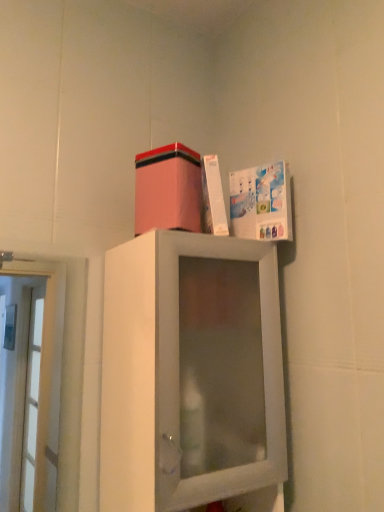
Question: Considering the relative sizes of pink matte cardboard box at upper center and white glossy book at upper right in the image provided, is pink matte cardboard box at upper center thinner than white glossy book at upper right?

Choices:
 (A) yes
 (B) no

Answer: (B)

Question: From the image's perspective, would you say pink matte cardboard box at upper center is positioned over white glossy book at upper right?

Choices:
 (A) yes
 (B) no

Answer: (A)

Question: From a real-world perspective, is pink matte cardboard box at upper center located higher than white glossy book at upper right?

Choices:
 (A) no
 (B) yes

Answer: (B)

Question: Is pink matte cardboard box at upper center shorter than white glossy book at upper right?

Choices:
 (A) no
 (B) yes

Answer: (B)

Question: Is pink matte cardboard box at upper center bigger than white glossy book at upper right?

Choices:
 (A) yes
 (B) no

Answer: (A)

Question: Could you tell me if pink matte cardboard box at upper center is facing white glossy book at upper right?

Choices:
 (A) yes
 (B) no

Answer: (B)

Question: From the image's perspective, is pink matte cardboard box at upper center over white matte cabinet at upper center?

Choices:
 (A) no
 (B) yes

Answer: (B)

Question: Is pink matte cardboard box at upper center taller than white matte cabinet at upper center?

Choices:
 (A) no
 (B) yes

Answer: (A)

Question: Is pink matte cardboard box at upper center not inside white matte cabinet at upper center?

Choices:
 (A) no
 (B) yes

Answer: (B)

Question: From a real-world perspective, is pink matte cardboard box at upper center under white matte cabinet at upper center?

Choices:
 (A) yes
 (B) no

Answer: (B)

Question: Would you say white matte cabinet at upper center is part of pink matte cardboard box at upper center's contents?

Choices:
 (A) no
 (B) yes

Answer: (A)

Question: From the image's perspective, is pink matte cardboard box at upper center beneath white matte cabinet at upper center?

Choices:
 (A) no
 (B) yes

Answer: (A)

Question: From the image's perspective, is white matte cabinet at upper center under pink matte cardboard box at upper center?

Choices:
 (A) no
 (B) yes

Answer: (B)